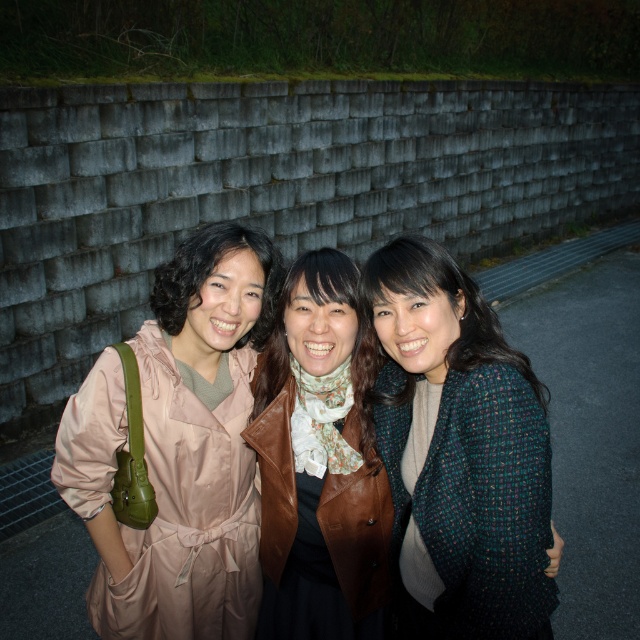
You are standing at the point marked as point (179, 448) in the image. Which object from the scene are you currently touching?

You are touching the matte pink coat at left because the point (179, 448) is on it.

You are a photographer adjusting your camera settings to capture the scene with the matte pink coat at left and the brown leather jacket at center. Which subject should you focus on first to ensure both are in sharp focus?

You should focus on the matte pink coat at left first because it is closer to the viewer than the brown leather jacket at center, ensuring proper depth of field for both subjects.

Looking at this image, you are a photographer trying to capture a clear shot of both the green tweed jacket at center and the brown leather jacket at center. Which jacket is covering part of the other one?

The green tweed jacket at center is positioned over brown leather jacket at center, so it is covering part of it.